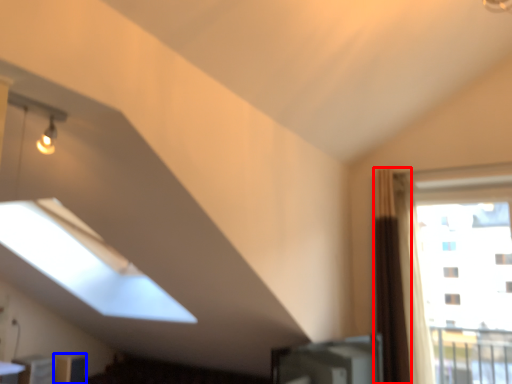
Question: Which object appears closest to the camera in this image, curtain (highlighted by a red box) or furniture (highlighted by a blue box)?

Choices:
 (A) curtain
 (B) furniture

Answer: (A)